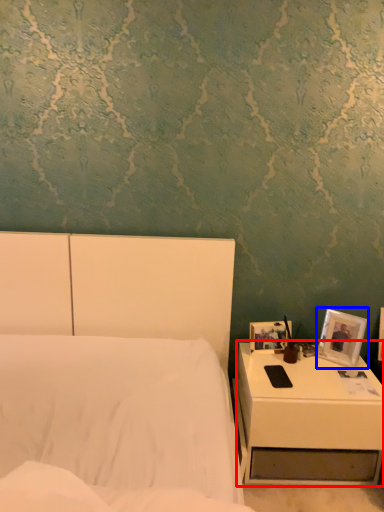
Question: Which of the following is the farthest to the observer, nightstand (highlighted by a red box) or picture frame (highlighted by a blue box)?

Choices:
 (A) nightstand
 (B) picture frame

Answer: (B)